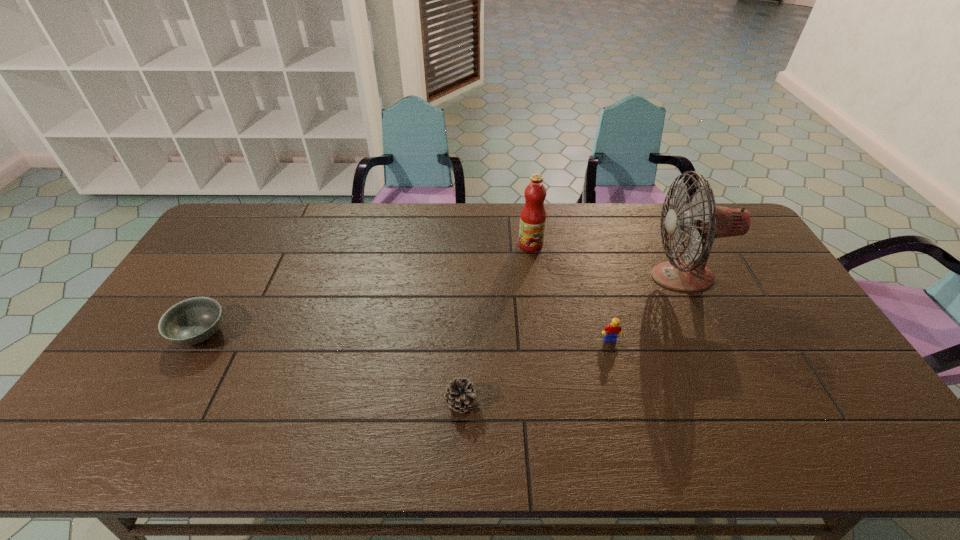
Find the location of a particular element. The image size is (960, 540). free space located 0.270m in front of the fan to direct airflow is located at coordinates (565, 276).

This screenshot has height=540, width=960. In order to click on vacant region located 0.100m on the front label of the fruit juice in this screenshot , I will do `click(534, 272)`.

Identify the location of free space located on the face of the Lego. (640, 455).

Locate an element on the screen. This screenshot has width=960, height=540. free point located on the left of the nearest object is located at coordinates (285, 402).

Image resolution: width=960 pixels, height=540 pixels. I want to click on blank area located 0.340m on the right of the leftmost object, so click(348, 334).

Where is `object that is positioned at the far edge`? The height and width of the screenshot is (540, 960). object that is positioned at the far edge is located at coordinates (533, 215).

Identify the location of object present at the left edge. This screenshot has width=960, height=540. (192, 321).

In the image, there is a desktop. Where is `free region at the far edge`? The width and height of the screenshot is (960, 540). free region at the far edge is located at coordinates (591, 238).

Find the location of a particular element. vacant space at the near edge is located at coordinates (799, 437).

Where is `free space at the left edge of the desktop`? free space at the left edge of the desktop is located at coordinates coord(219,296).